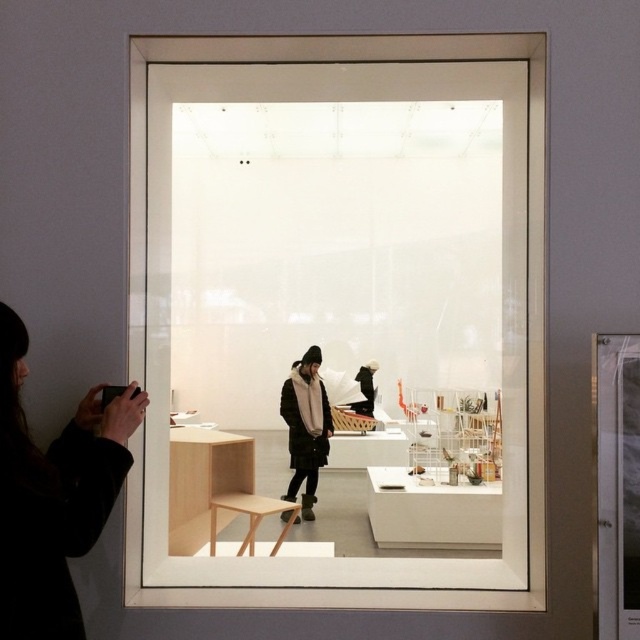
Between light wood bench at center and black fabric at left, which one has more height?

light wood bench at center

Is point (291, 84) positioned in front of point (8, 573)?

No, (291, 84) is further to viewer.

What are the coordinates of `light wood bench at center` in the screenshot? It's located at (500, 301).

Is black woolen coat at center smaller than light brown wooden stool at center?

Yes, black woolen coat at center is smaller than light brown wooden stool at center.

The width and height of the screenshot is (640, 640). What do you see at coordinates (305, 426) in the screenshot?
I see `black woolen coat at center` at bounding box center [305, 426].

Where is `black woolen coat at center`? This screenshot has height=640, width=640. black woolen coat at center is located at coordinates (305, 426).

Does black fabric at left have a greater width compared to black woolen coat at center?

Yes.

Between point (67, 520) and point (282, 497), which one is positioned in front?

Point (67, 520) is in front.

The image size is (640, 640). I want to click on black fabric at left, so click(x=52, y=493).